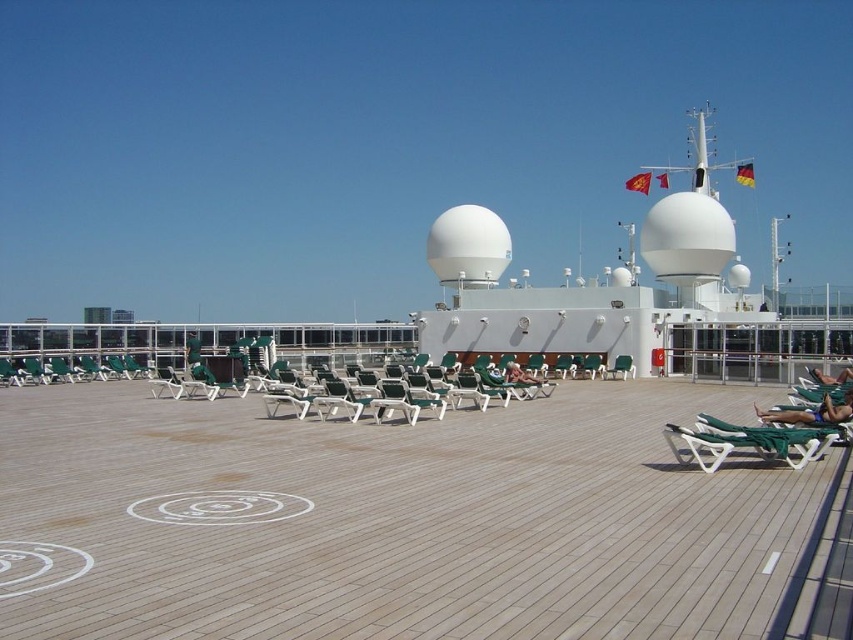
Does green fabric beach chair at lower right appear on the right side of blue fabric person at lower right?

In fact, green fabric beach chair at lower right is to the left of blue fabric person at lower right.

In the scene shown: Can you confirm if green fabric beach chair at lower right is smaller than blue fabric person at lower right?

No.

Is point (711, 424) closer to viewer compared to point (799, 422)?

Yes, it is.

I want to click on green fabric beach chair at lower right, so click(747, 442).

Which of these two, wooden deck at center or green fabric chair at center, stands taller?

green fabric chair at center is taller.

Is wooden deck at center bigger than green fabric chair at center?

Yes.

What do you see at coordinates (393, 520) in the screenshot? The image size is (853, 640). I see `wooden deck at center` at bounding box center [393, 520].

Locate an element on the screen. The image size is (853, 640). wooden deck at center is located at coordinates (393, 520).

Does blue fabric person at lower right have a greater height compared to tan skin person at lower right?

Indeed, blue fabric person at lower right has a greater height compared to tan skin person at lower right.

Does blue fabric person at lower right have a greater width compared to tan skin person at lower right?

Yes, blue fabric person at lower right is wider than tan skin person at lower right.

Is point (805, 417) behind point (834, 380)?

That is False.

You are a GUI agent. You are given a task and a screenshot of the screen. Output one action in this format:
    pyautogui.click(x=<x>, y=<y>)
    Task: Click on the blue fabric person at lower right
    
    Given the screenshot: What is the action you would take?
    pyautogui.click(x=811, y=412)